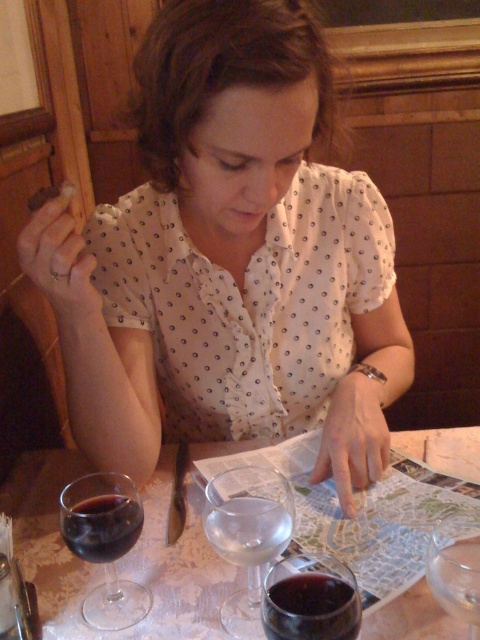
Question: Which object is the farthest from the white dotted blouse at center?

Choices:
 (A) white crumbly bread at upper left
 (B) translucent glass wine at lower left
 (C) clear glass wine glass at center
 (D) transparent glass at center

Answer: (D)

Question: Which object is closer to the camera taking this photo?

Choices:
 (A) clear glass wine glass at center
 (B) dark red glass at lower center

Answer: (B)

Question: Observing the image, what is the correct spatial positioning of clear glass wine glass at center in reference to dark red glass at lower center?

Choices:
 (A) below
 (B) above

Answer: (B)

Question: Is white dotted blouse at center to the right of translucent glass wine at lower left from the viewer's perspective?

Choices:
 (A) no
 (B) yes

Answer: (B)

Question: Can you confirm if clear glass wine glass at center is thinner than dark red glass at lower left?

Choices:
 (A) yes
 (B) no

Answer: (B)

Question: Which object is farther from the camera taking this photo?

Choices:
 (A) dark red glass at lower left
 (B) white dotted blouse at center
 (C) translucent glass wine at lower left
 (D) clear glass wine glass at center

Answer: (C)